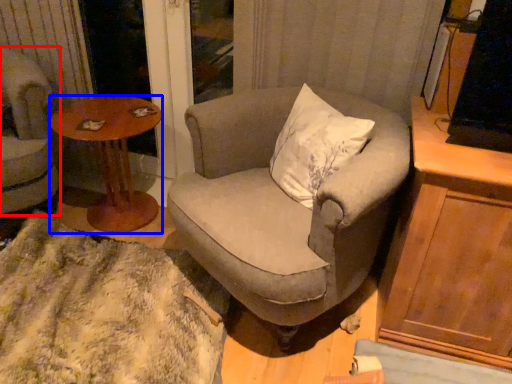
Question: Which object appears closest to the camera in this image, chair (highlighted by a red box) or coffee table (highlighted by a blue box)?

Choices:
 (A) chair
 (B) coffee table

Answer: (A)